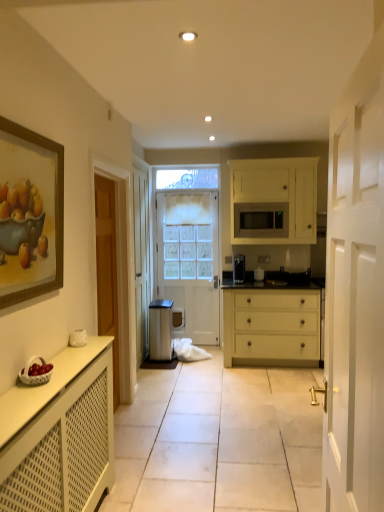
Identify the location of free point above white matte radiator at lower left, which is counted as the 1th cabinetry, starting from the bottom (from a real-world perspective). (49, 372).